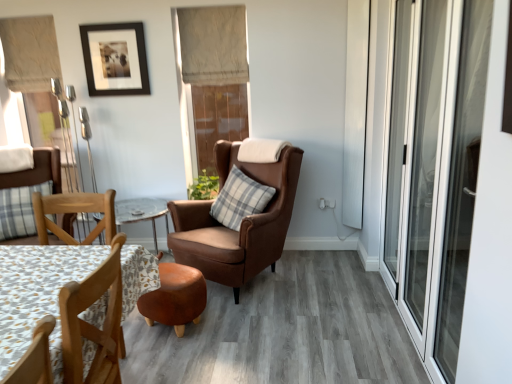
Question: Does point (210, 193) appear closer or farther from the camera than point (212, 29)?

Choices:
 (A) closer
 (B) farther

Answer: (B)

Question: Is green leafy plant at center taller or shorter than beige fabric curtain at upper center, which ranks as the 1th curtain in right-to-left order?

Choices:
 (A) short
 (B) tall

Answer: (A)

Question: Which of these objects is positioned farthest from the beige fabric curtain at upper center, which ranks as the 1th curtain in right-to-left order?

Choices:
 (A) beige fabric curtain at upper left, placed as the second curtain when sorted from right to left
 (B) green leafy plant at center
 (C) brown leather wingback chair at center, the 2th chair positioned from the left
 (D) plaid fabric pillow at center
 (E) black matte picture frame at upper center

Answer: (A)

Question: Estimate the real-world distances between objects in this image. Which object is farther from the brown leather wingback chair at center, the 2th chair positioned from the left?

Choices:
 (A) patterned fabric coffee table at lower left
 (B) transparent glass screen door at right
 (C) beige fabric curtain at upper center, which ranks as the 1th curtain in right-to-left order
 (D) black matte picture frame at upper center
 (E) plaid fabric pillow at center

Answer: (D)